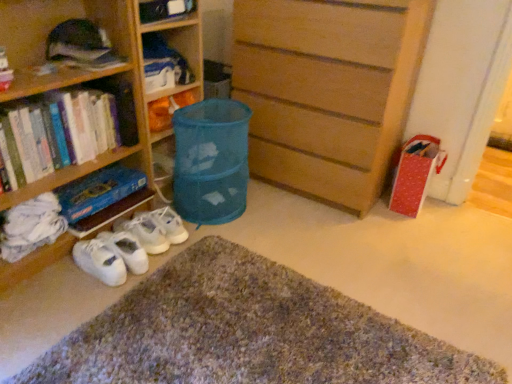
Where is `vacant space that's between wooden chest of drawers at center and textured woolen doormat at lower center`? This screenshot has height=384, width=512. vacant space that's between wooden chest of drawers at center and textured woolen doormat at lower center is located at coordinates (342, 255).